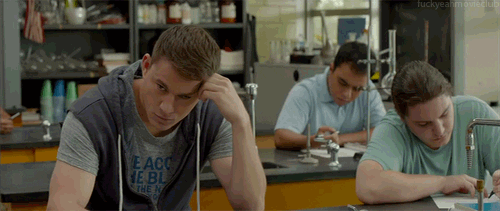
Locate an element on the screen. sink in the laboratory tables is located at coordinates (287, 164).